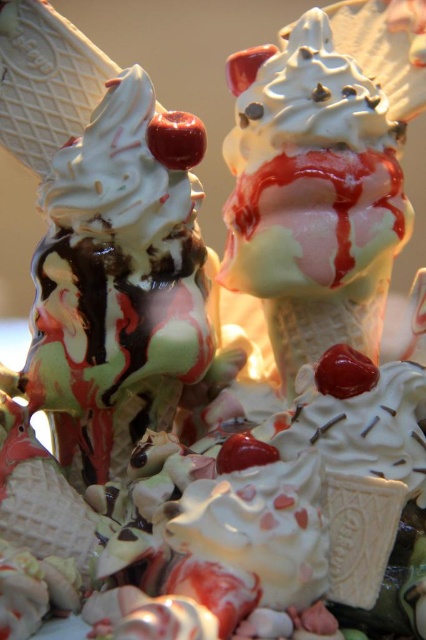
Who is higher up, swirled vanilla ice cream at center or white chocolate ice cream cone at center?

white chocolate ice cream cone at center is above.

Between point (43, 188) and point (284, 33), which one is positioned behind?

Positioned behind is point (284, 33).

The height and width of the screenshot is (640, 426). I want to click on swirled vanilla ice cream at center, so click(x=117, y=292).

Which of these two, white chocolate ice cream cone at center or shiny red cherry at center, stands shorter?

shiny red cherry at center

Is white chocolate ice cream cone at center thinner than shiny red cherry at center?

No.

Who is more forward, (411, 54) or (198, 140)?

Positioned in front is point (198, 140).

I want to click on white chocolate ice cream cone at center, so click(x=321, y=177).

Is swirled vanilla ice cream at center in front of shiny red cherry at center?

That is True.

Is swirled vanilla ice cream at center taller than shiny red cherry at center?

Yes, swirled vanilla ice cream at center is taller than shiny red cherry at center.

Describe the element at coordinates (117, 292) in the screenshot. The width and height of the screenshot is (426, 640). I see `swirled vanilla ice cream at center` at that location.

I want to click on swirled vanilla ice cream at center, so click(x=117, y=292).